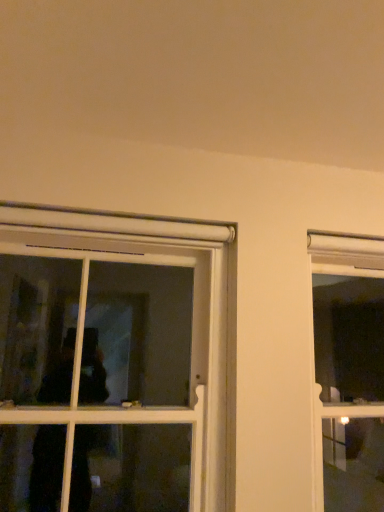
Question: From a real-world perspective, is clear glass window at right, which is the second window from left to right, positioned under white plastic window at left, which is counted as the second window, starting from the right, based on gravity?

Choices:
 (A) yes
 (B) no

Answer: (A)

Question: Is clear glass window at right, which is the second window from left to right, taller than white plastic window at left, which is counted as the second window, starting from the right?

Choices:
 (A) no
 (B) yes

Answer: (B)

Question: Does clear glass window at right, which is counted as the 1th window, starting from the right, have a lesser height compared to white plastic window at left, which is counted as the second window, starting from the right?

Choices:
 (A) yes
 (B) no

Answer: (B)

Question: Can you confirm if clear glass window at right, which is the second window from left to right, is bigger than white plastic window at left, the 1th window viewed from the left?

Choices:
 (A) no
 (B) yes

Answer: (A)

Question: Is clear glass window at right, which is counted as the 1th window, starting from the right, to the left of white plastic window at left, the 1th window viewed from the left, from the viewer's perspective?

Choices:
 (A) yes
 (B) no

Answer: (B)

Question: Can you confirm if clear glass window at right, which is counted as the 1th window, starting from the right, is positioned to the right of white plastic window at left, which is counted as the second window, starting from the right?

Choices:
 (A) no
 (B) yes

Answer: (B)

Question: Would you consider white plastic window at left, which is counted as the second window, starting from the right, to be distant from clear glass window at right, which is the second window from left to right?

Choices:
 (A) no
 (B) yes

Answer: (B)

Question: Does white plastic window at left, which is counted as the second window, starting from the right, appear on the left side of clear glass window at right, which is the second window from left to right?

Choices:
 (A) no
 (B) yes

Answer: (B)

Question: Does white plastic window at left, which is counted as the second window, starting from the right, have a lesser width compared to clear glass window at right, which is the second window from left to right?

Choices:
 (A) no
 (B) yes

Answer: (B)

Question: Can you confirm if white plastic window at left, the 1th window viewed from the left, is bigger than clear glass window at right, which is the second window from left to right?

Choices:
 (A) no
 (B) yes

Answer: (B)

Question: Could you tell me if white plastic window at left, which is counted as the second window, starting from the right, is facing clear glass window at right, which is the second window from left to right?

Choices:
 (A) yes
 (B) no

Answer: (B)

Question: Is white plastic window at left, which is counted as the second window, starting from the right, at the right side of clear glass window at right, which is the second window from left to right?

Choices:
 (A) no
 (B) yes

Answer: (A)

Question: Considering the relative positions of white plastic window at left, the 1th window viewed from the left, and clear glass window at right, which is the second window from left to right, in the image provided, is white plastic window at left, the 1th window viewed from the left, to the left or to the right of clear glass window at right, which is the second window from left to right,?

Choices:
 (A) right
 (B) left

Answer: (B)